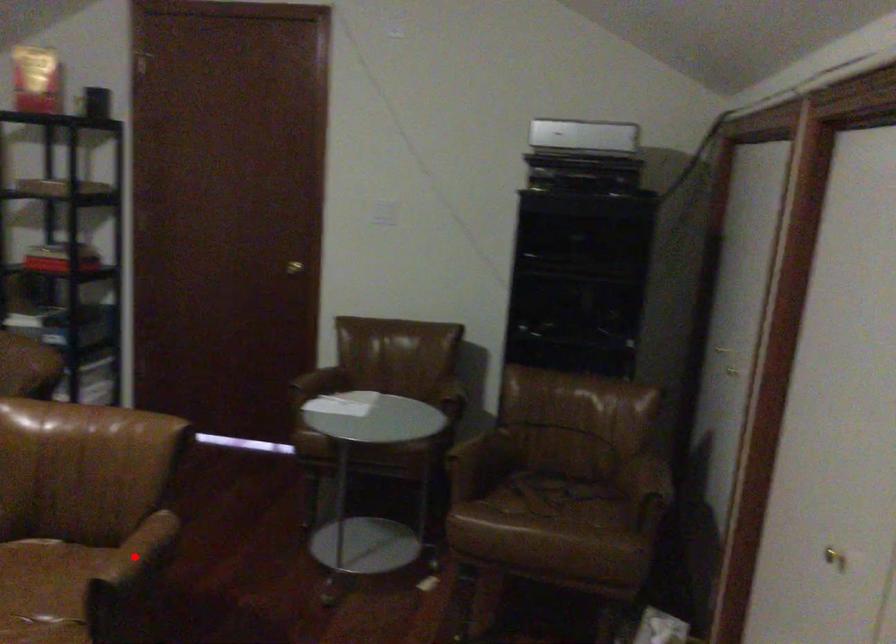
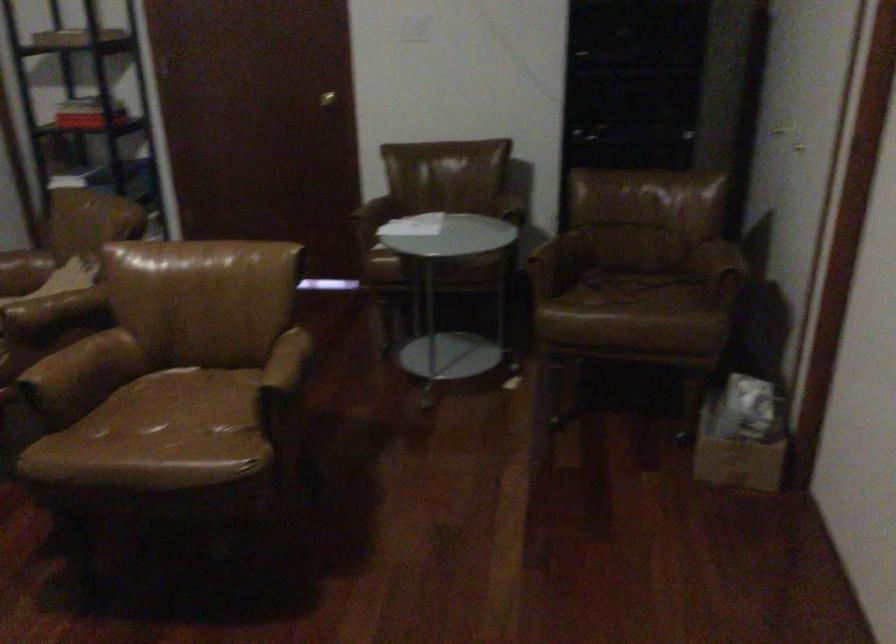
Locate, in the second image, the point that corresponds to the highlighted location in the first image.

(283, 371)